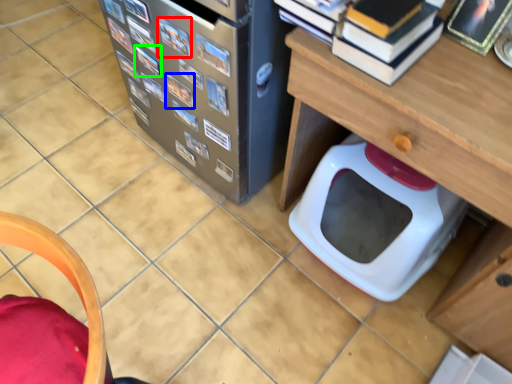
Question: Which is nearer to the book (highlighted by a red box)? book (highlighted by a blue box) or book (highlighted by a green box).

Choices:
 (A) book
 (B) book

Answer: (A)